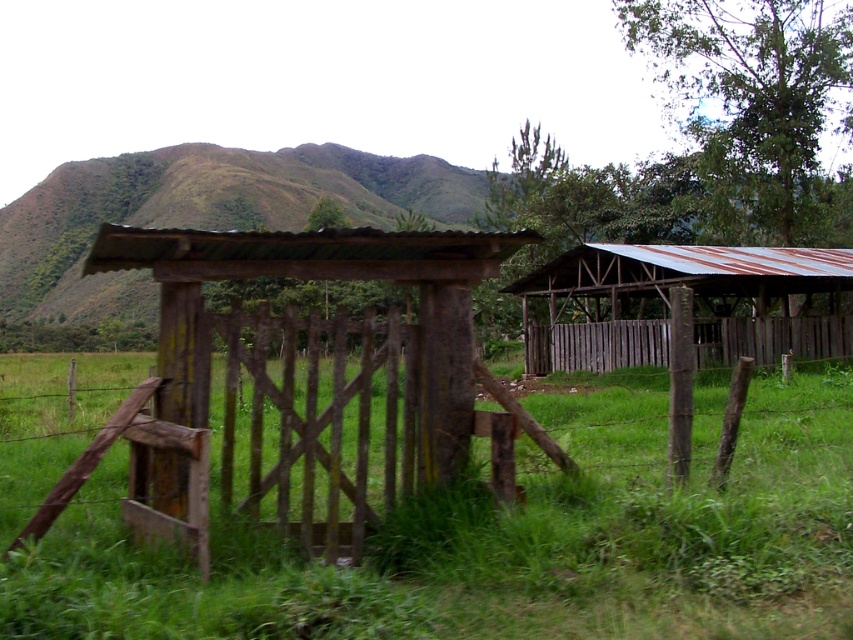
You are standing at the green grassy at center and want to walk to the rusty corrugated metal barn at right. If your walking speed is 1.5 meters per second, how many seconds will it take you to reach the barn?

The distance between green grassy at center and rusty corrugated metal barn at right is 6.10 meters. At a walking speed of 1.5 meters per second, it will take approximately 4.07 seconds to reach the barn.

You are a gardener planning to plant a row of flowers between the green grassy at center and the weathered wood gate at center. Based on the scene, which area has more space available for planting?

The green grassy at center has more space available for planting since it is wider than the weathered wood gate at center according to the description.